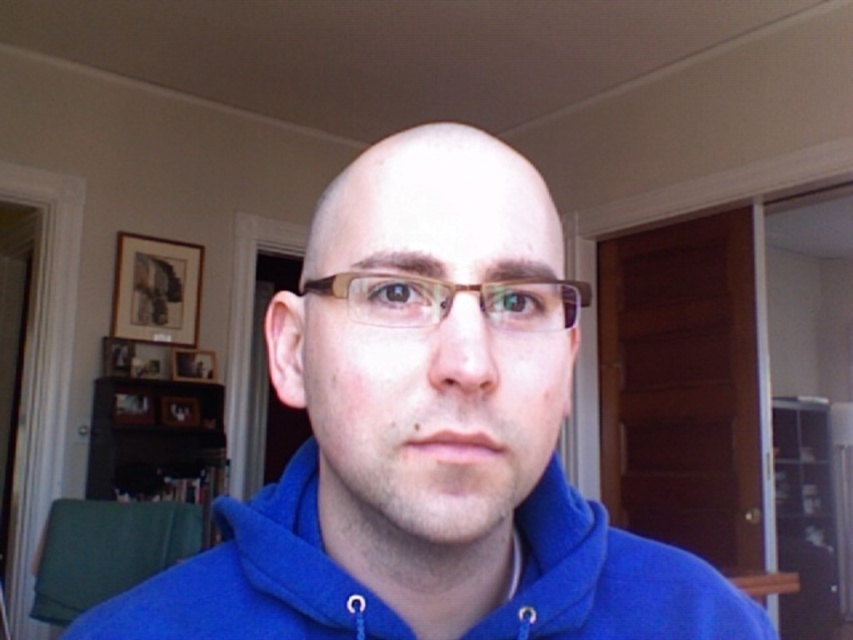
Does blue fleece jacket at center have a smaller size compared to brown translucent glasses at center?

Incorrect, blue fleece jacket at center is not smaller in size than brown translucent glasses at center.

Is blue fleece jacket at center closer to camera compared to brown translucent glasses at center?

No, it is behind brown translucent glasses at center.

What do you see at coordinates (252, 579) in the screenshot?
I see `blue fleece jacket at center` at bounding box center [252, 579].

The height and width of the screenshot is (640, 853). Identify the location of blue fleece jacket at center. (252, 579).

Does blue matte hoodie at center have a smaller size compared to brown translucent glasses at center?

Actually, blue matte hoodie at center might be larger than brown translucent glasses at center.

Is blue matte hoodie at center closer to the viewer compared to brown translucent glasses at center?

Yes, blue matte hoodie at center is closer to the viewer.

Does point (648, 566) lie behind point (419, 321)?

Yes.

In order to click on blue matte hoodie at center in this screenshot , I will do `click(428, 436)`.

Between blue matte hoodie at center and blue fleece jacket at center, which one is positioned lower?

blue fleece jacket at center is lower down.

Does point (367, 221) come farther from viewer compared to point (563, 582)?

No.

Find the location of a particular element. blue matte hoodie at center is located at coordinates (428, 436).